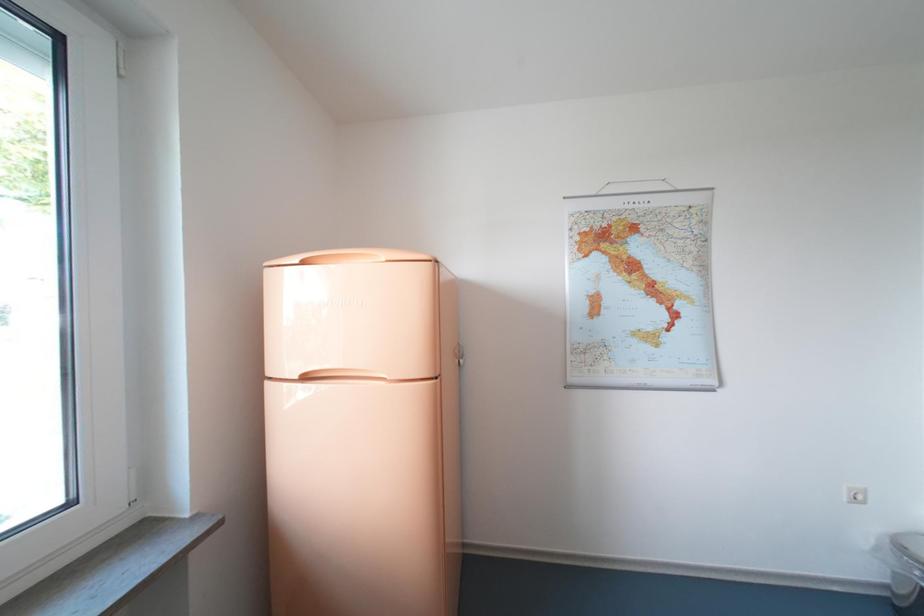
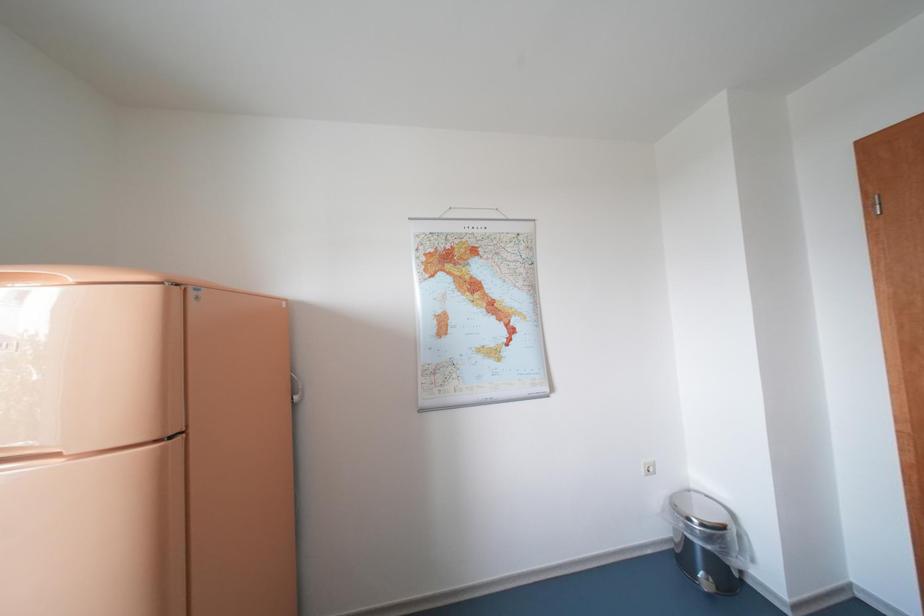
Question: The camera is either moving clockwise (left) or counter-clockwise (right) around the object. The first image is from the beginning of the video and the second image is from the end. Is the camera moving left or right when shooting the video?

Choices:
 (A) Left
 (B) Right

Answer: (A)